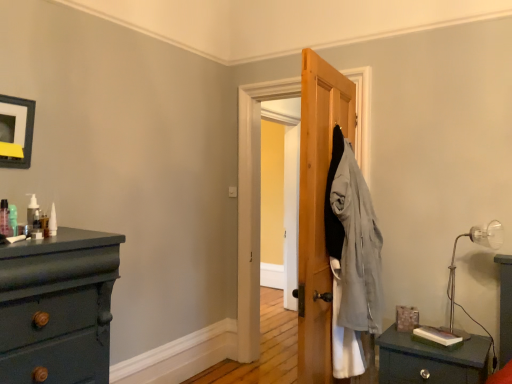
Question: Considering the relative sizes of translucent plastic pump at left, the 2th toiletry when ordered from front to back, and matte black nightstand at lower right in the image provided, is translucent plastic pump at left, the 2th toiletry when ordered from front to back, smaller than matte black nightstand at lower right?

Choices:
 (A) no
 (B) yes

Answer: (B)

Question: Can you confirm if translucent plastic pump at left, the 2th toiletry when ordered from front to back, is positioned to the right of matte black nightstand at lower right?

Choices:
 (A) yes
 (B) no

Answer: (B)

Question: Is translucent plastic pump at left, which ranks as the second toiletry in right-to-left order, in front of matte black nightstand at lower right?

Choices:
 (A) no
 (B) yes

Answer: (B)

Question: Is translucent plastic pump at left, acting as the second toiletry starting from the back, touching matte black nightstand at lower right?

Choices:
 (A) no
 (B) yes

Answer: (A)

Question: Is translucent plastic pump at left, the 2th toiletry when ordered from front to back, oriented towards matte black nightstand at lower right?

Choices:
 (A) yes
 (B) no

Answer: (B)

Question: In the image, is matte black nightstand at lower right positioned in front of or behind translucent plastic pump at left, marked as the 2th toiletry in a left-to-right arrangement?

Choices:
 (A) behind
 (B) front

Answer: (A)

Question: Which is correct: matte black nightstand at lower right is inside translucent plastic pump at left, the 2th toiletry when ordered from front to back, or outside of it?

Choices:
 (A) outside
 (B) inside

Answer: (A)

Question: From the image's perspective, is matte black nightstand at lower right positioned above or below translucent plastic pump at left, which ranks as the second toiletry in right-to-left order?

Choices:
 (A) above
 (B) below

Answer: (B)

Question: Considering the positions of matte black nightstand at lower right and translucent plastic pump at left, marked as the 2th toiletry in a left-to-right arrangement, in the image, is matte black nightstand at lower right bigger or smaller than translucent plastic pump at left, marked as the 2th toiletry in a left-to-right arrangement,?

Choices:
 (A) small
 (B) big

Answer: (B)

Question: Would you say translucent plastic pump at left, which is the third toiletry from right to left, is to the left or to the right of matte black picture frame at upper left in the picture?

Choices:
 (A) right
 (B) left

Answer: (A)

Question: Based on their sizes in the image, would you say translucent plastic pump at left, which ranks as the first toiletry in left-to-right order, is bigger or smaller than matte black picture frame at upper left?

Choices:
 (A) small
 (B) big

Answer: (A)

Question: Relative to matte black picture frame at upper left, is translucent plastic pump at left, which is the 3th toiletry from back to front, in front or behind?

Choices:
 (A) front
 (B) behind

Answer: (A)

Question: Is translucent plastic pump at left, which ranks as the first toiletry in front-to-back order, taller or shorter than matte black picture frame at upper left?

Choices:
 (A) short
 (B) tall

Answer: (A)

Question: In terms of width, does white matte bottle at upper left, arranged as the first toiletry when viewed from the right, look wider or thinner when compared to matte black picture frame at upper left?

Choices:
 (A) wide
 (B) thin

Answer: (B)

Question: In terms of size, does white matte bottle at upper left, arranged as the first toiletry when viewed from the right, appear bigger or smaller than matte black picture frame at upper left?

Choices:
 (A) small
 (B) big

Answer: (A)